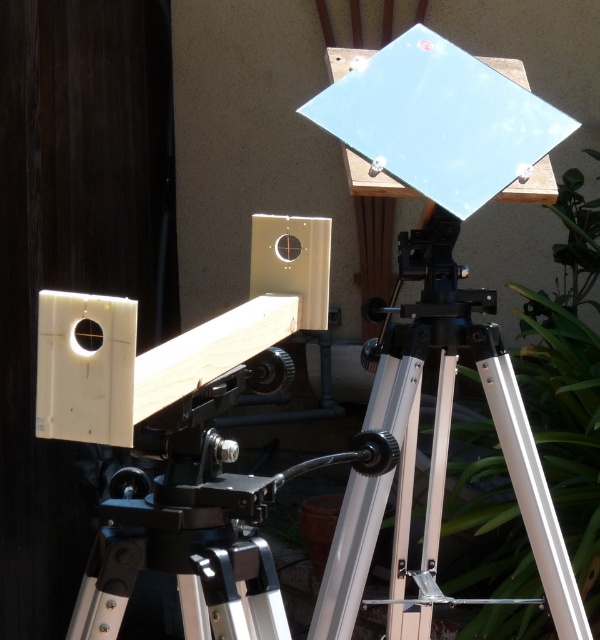
Is silver metallic tripod at center below matte black lens at center?

A: Yes.

Where is `silver metallic tripod at center`? Image resolution: width=600 pixels, height=640 pixels. silver metallic tripod at center is located at coordinates (450, 422).